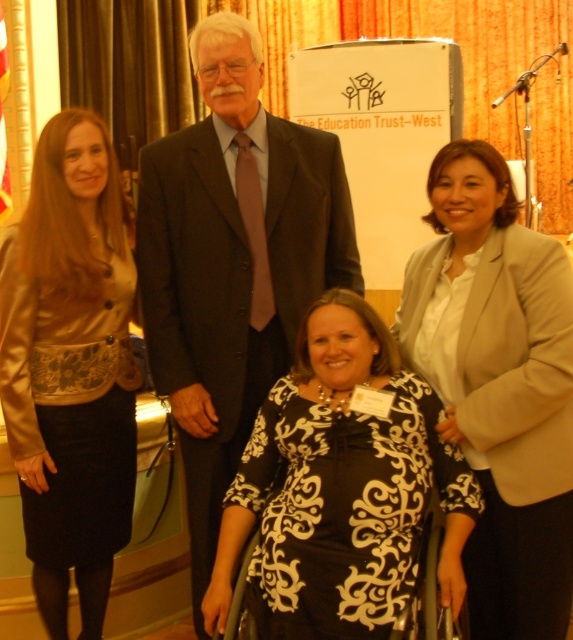
You are a photographer adjusting camera settings. The dark gray suit at center and the satin gold jacket at left are in focus. Which clothing item has a wider silhouette when viewed from the front?

The dark gray suit at center has a wider silhouette than the satin gold jacket at left because its width surpasses the jacket.